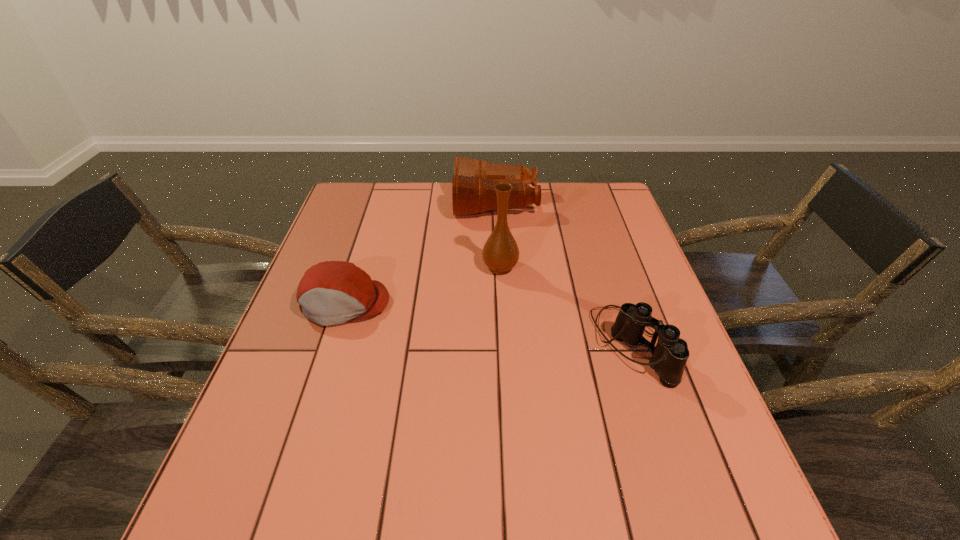
Find the location of a particular element. This screenshot has width=960, height=540. vase is located at coordinates (500, 253).

At what (x,y) coordinates should I click in order to perform the action: click on the tallest object. Please return your answer as a coordinate pair (x, y). This screenshot has width=960, height=540. Looking at the image, I should click on (500, 253).

The height and width of the screenshot is (540, 960). What are the coordinates of `the farther binoculars` in the screenshot? It's located at (473, 191).

Image resolution: width=960 pixels, height=540 pixels. In order to click on the farthest object in this screenshot , I will do `click(473, 191)`.

The image size is (960, 540). I want to click on the right binoculars, so click(x=669, y=356).

Where is `the rightmost object`? Image resolution: width=960 pixels, height=540 pixels. the rightmost object is located at coordinates (669, 356).

The width and height of the screenshot is (960, 540). What are the coordinates of `cap` in the screenshot? It's located at (332, 292).

The height and width of the screenshot is (540, 960). Find the location of `the leftmost object`. the leftmost object is located at coordinates (332, 292).

At what (x,y) coordinates should I click in order to perform the action: click on free location located on the left of the tallest object. Please return your answer as a coordinate pair (x, y). This screenshot has width=960, height=540. Looking at the image, I should click on (397, 267).

This screenshot has width=960, height=540. I want to click on free space located 0.260m through the lenses of the farthest object, so click(375, 203).